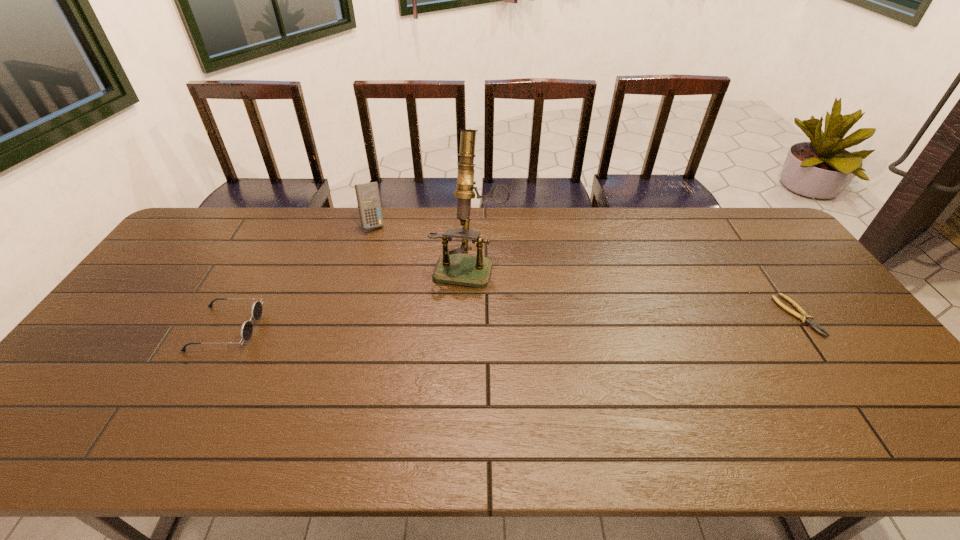
The image size is (960, 540). Find the location of `vacant space located 0.240m at the eyepiece of the third object from left to right`. vacant space located 0.240m at the eyepiece of the third object from left to right is located at coordinates (444, 352).

Identify the location of free location located 0.250m at the eyepiece of the third object from left to right. This screenshot has width=960, height=540. (443, 355).

Locate an element on the screen. The image size is (960, 540). vacant space situated at the eyepiece of the third object from left to right is located at coordinates (455, 313).

At what (x,y) coordinates should I click in order to perform the action: click on free space located on the front-facing side of the third object from right to left. Please return your answer as a coordinate pair (x, y). Looking at the image, I should click on (393, 261).

Locate an element on the screen. vacant space located on the front-facing side of the third object from right to left is located at coordinates (404, 280).

At what (x,y) coordinates should I click in order to perform the action: click on free spot located on the front-facing side of the third object from right to left. Please return your answer as a coordinate pair (x, y). This screenshot has height=540, width=960. Looking at the image, I should click on (405, 282).

At what (x,y) coordinates should I click in order to perform the action: click on microscope situated at the far edge. Please return your answer as a coordinate pair (x, y). This screenshot has height=540, width=960. Looking at the image, I should click on (452, 268).

Locate an element on the screen. calculator located in the far edge section of the desktop is located at coordinates (368, 198).

This screenshot has height=540, width=960. Find the location of `object that is at the right edge`. object that is at the right edge is located at coordinates (803, 316).

Where is `free space at the far edge`? The height and width of the screenshot is (540, 960). free space at the far edge is located at coordinates (414, 215).